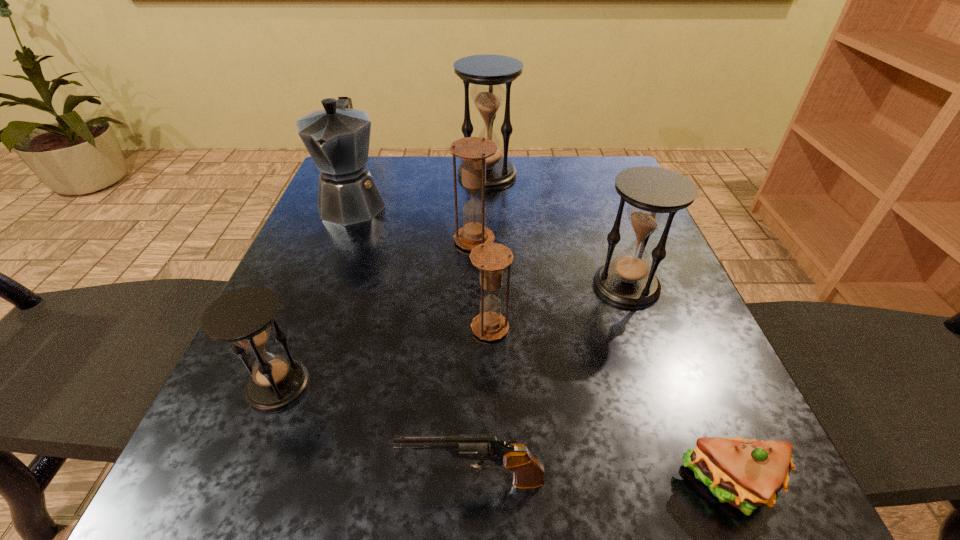
Where is `free spot between the second smallest black hourglass and the black gun`? The width and height of the screenshot is (960, 540). free spot between the second smallest black hourglass and the black gun is located at coordinates (550, 383).

Image resolution: width=960 pixels, height=540 pixels. I want to click on free space that is in between the coffeepot and the smaller brown hourglass, so 421,265.

Locate an element on the screen. free space between the nearest black hourglass and the coffeepot is located at coordinates (316, 294).

Where is `unoccupied position between the nearest black hourglass and the bigger brown hourglass`? unoccupied position between the nearest black hourglass and the bigger brown hourglass is located at coordinates (376, 313).

Find the location of a particular element. The height and width of the screenshot is (540, 960). free space between the second farthest hourglass and the third nearest hourglass is located at coordinates (550, 263).

You are a GUI agent. You are given a task and a screenshot of the screen. Output one action in this format:
    pyautogui.click(x=<x>, y=<y>)
    Task: Click on the free space between the bigger brown hourglass and the rightmost hourglass
    The height and width of the screenshot is (540, 960).
    Given the screenshot: What is the action you would take?
    pyautogui.click(x=550, y=263)

In order to click on empty location between the gun and the smallest black hourglass in this screenshot , I will do `click(376, 433)`.

Identify the location of empty space between the black gun and the smaller brown hourglass. pos(482,404).

Identify the location of object that is the third closest to the tallest hourglass. (654, 195).

Where is `object that is the fifth closest to the sandwich`? Image resolution: width=960 pixels, height=540 pixels. object that is the fifth closest to the sandwich is located at coordinates (243, 316).